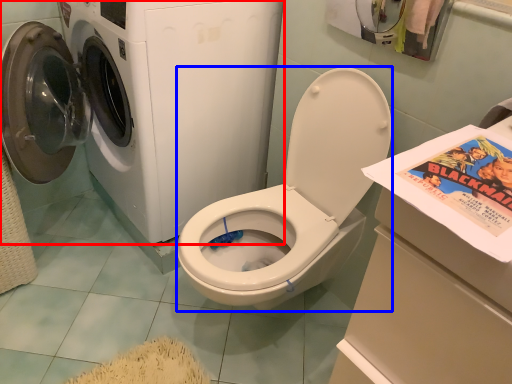
Question: Which of the following is the closest to the observer, washing machine (highlighted by a red box) or washer (highlighted by a blue box)?

Choices:
 (A) washing machine
 (B) washer

Answer: (B)